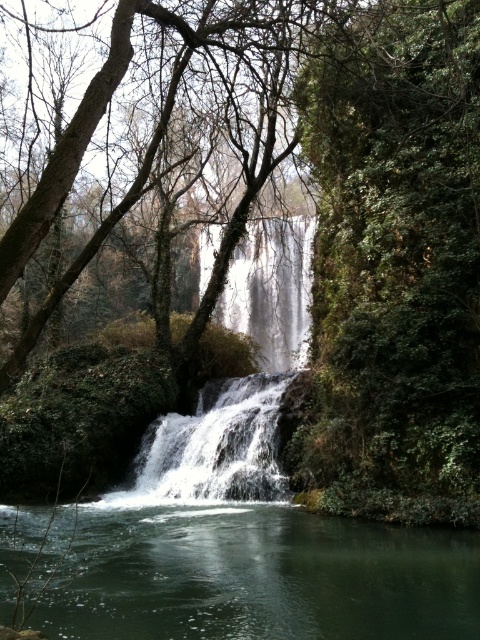
You are standing at the base of the waterfall and want to take a photo that includes both the point at coordinates point (229, 561) and point (178, 422). Given that the camera has a fixed focal length, which point should you position closer to the center of the frame to ensure both are in focus?

To ensure both points are in focus, position the point at coordinates point (229, 561) closer to the center of the frame since it is closer to the viewer. This helps maintain depth of field for both points.

You are standing at the edge of the waterfall and see the clear water at center and the white frothy water at center. Which one is positioned to the right side from your viewpoint?

The clear water at center is positioned to the right of the white frothy water at center, so the clear water at center is on the right side from your viewpoint.

You are standing at the edge of the waterfall and see the green leafy tree at center and the white frothy water at center. Which object is higher in elevation?

The green leafy tree at center is above the white frothy water at center, so it is higher in elevation.